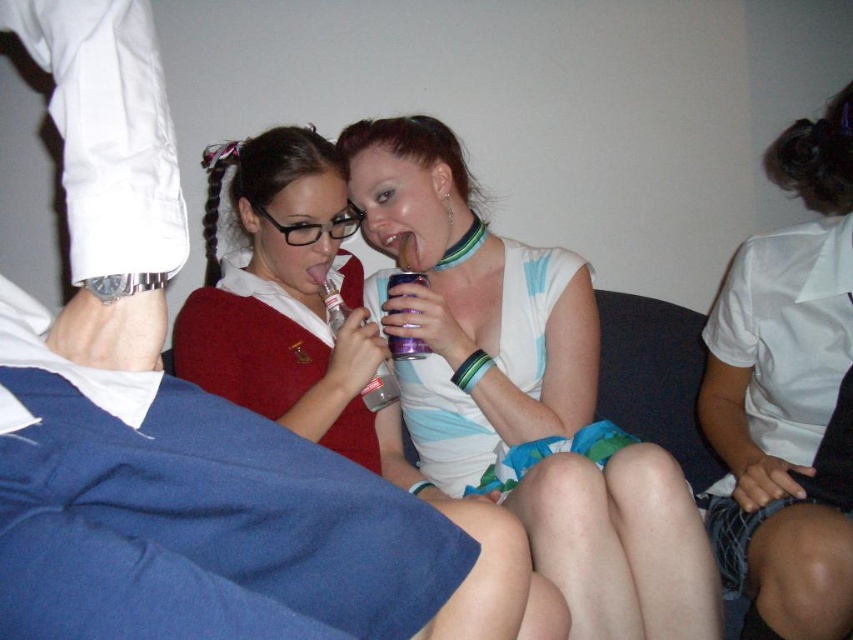
Question: Which object appears closest to the camera in this image?

Choices:
 (A) purple metallic can at center
 (B) matte white dress at center

Answer: (B)

Question: From the image, what is the correct spatial relationship of matte plastic cup at center in relation to matte white dress at center?

Choices:
 (A) left
 (B) right

Answer: (B)

Question: Can you confirm if white matte shirt at upper right is wider than matte white dress at center?

Choices:
 (A) no
 (B) yes

Answer: (A)

Question: Which of the following is the closest to the observer?

Choices:
 (A) (331, 144)
 (B) (752, 474)
 (C) (387, 296)
 (D) (410, 204)

Answer: (B)

Question: Is matte plastic cup at center thinner than matte white dress at center?

Choices:
 (A) no
 (B) yes

Answer: (A)

Question: Which of the following is the farthest from the observer?

Choices:
 (A) purple metallic can at center
 (B) matte plastic cup at center
 (C) matte white dress at center
 (D) white matte shirt at upper right

Answer: (A)